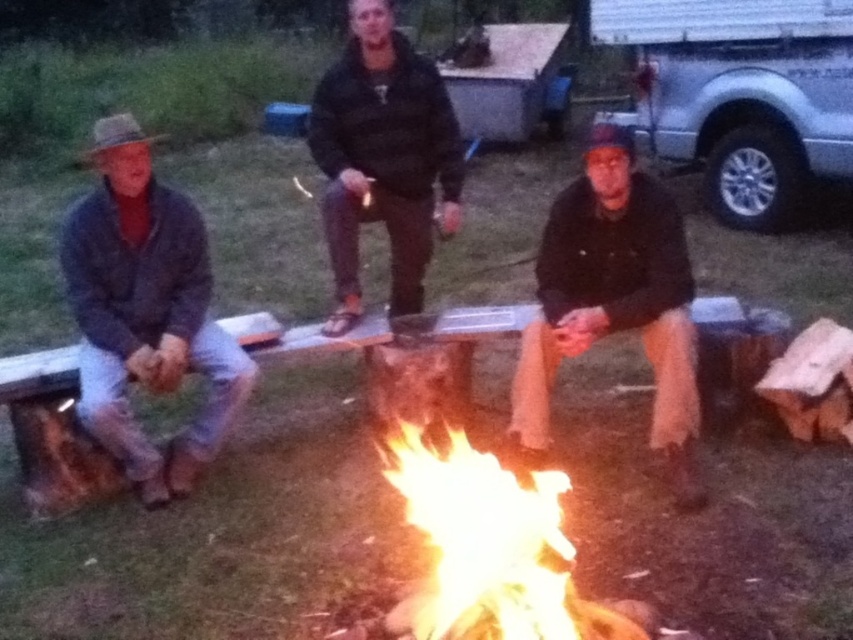
You are planning to take a photo of the silver metallic truck at upper right and the flaming wood at center. Which object should you zoom in more on to capture its full width in the frame?

You should zoom in more on the flaming wood at center because the silver metallic truck at upper right is wider than the flaming wood at center, so the truck will require a wider angle to capture its full width, whereas the flaming wood at center is narrower and can be captured with a closer zoom.

You are a photographer trying to capture a closeup of the flaming wood at center without the silver metallic truck at upper right appearing in the frame. Based on their positions, is this possible?

The silver metallic truck at upper right is located above the flaming wood at center, so if you position your camera below the truck, you can capture the flaming wood at center without the truck obstructing the view.

In the scene shown: You are a photographer trying to capture a group photo of the denim jacket at left and the black matte jacket at center. The camera frame can only accommodate a width of 1.2 meters. Based on their positions, will both jackets fit within the frame?

The denim jacket at left might be wider than black matte jacket at center, so the total width of both jackets could exceed the camera frame of 1.2 meters. It is uncertain if they will fit without adjusting their positions.